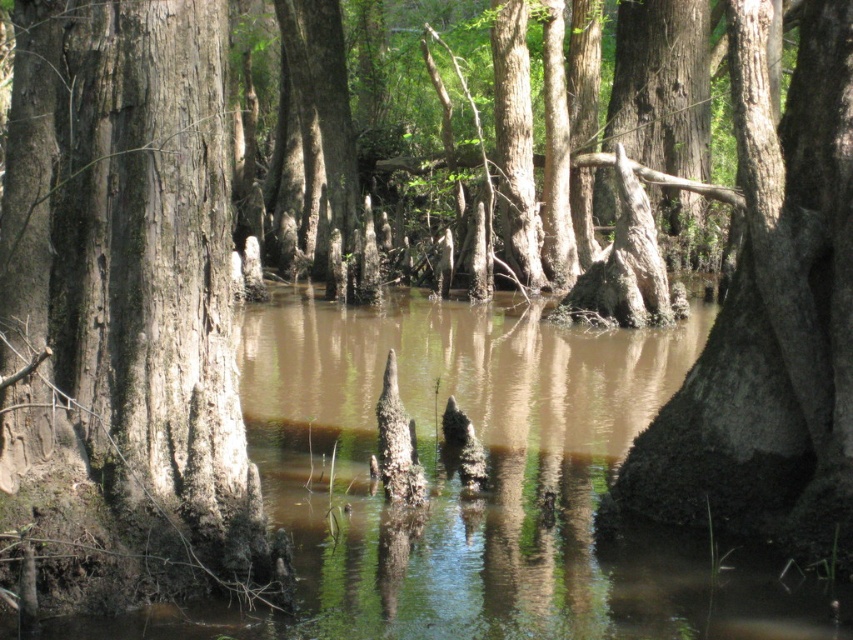
Question: Can you confirm if brown muddy water at center is smaller than smooth gray bark at center?

Choices:
 (A) yes
 (B) no

Answer: (B)

Question: Which object is farther from the camera taking this photo?

Choices:
 (A) smooth bark tree at center
 (B) smooth gray bark at center
 (C) brown muddy water at center

Answer: (B)

Question: Can you confirm if smooth bark tree at center is positioned above smooth gray bark at center?

Choices:
 (A) no
 (B) yes

Answer: (A)

Question: Among these objects, which one is nearest to the camera?

Choices:
 (A) smooth bark tree at center
 (B) brown muddy water at center

Answer: (A)

Question: Considering the real-world distances, which object is closest to the brown muddy water at center?

Choices:
 (A) smooth gray bark at center
 (B) smooth bark tree at center

Answer: (B)

Question: Does brown muddy water at center appear on the left side of smooth gray bark at center?

Choices:
 (A) yes
 (B) no

Answer: (A)